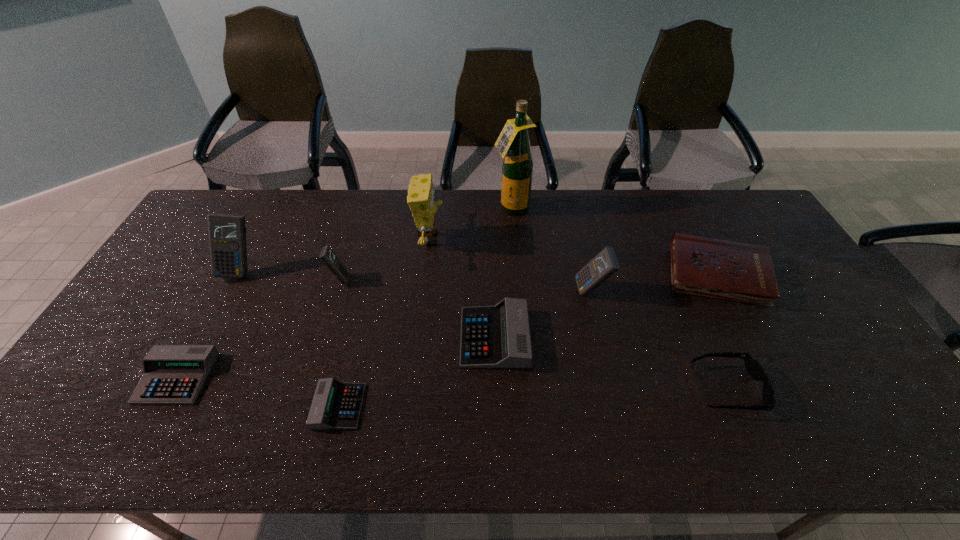
Find the location of a particular element. This screenshot has height=540, width=960. the biggest gray calculator is located at coordinates (498, 336).

Locate an element on the screen. the fourth tallest calculator is located at coordinates pos(498,336).

This screenshot has height=540, width=960. I want to click on sunglasses, so click(753, 367).

Identify the location of the fifth tallest calculator. The width and height of the screenshot is (960, 540). (172, 374).

At what (x,y) coordinates should I click in order to perform the action: click on the second smallest gray calculator. Please return your answer as a coordinate pair (x, y). Looking at the image, I should click on 172,374.

What are the coordinates of `the second gray calculator from left to right` in the screenshot? It's located at (336, 405).

Locate an element on the screen. The image size is (960, 540). the third calculator from right to left is located at coordinates (336, 405).

Where is `free location located on the front-facing side of the tallest object`? The image size is (960, 540). free location located on the front-facing side of the tallest object is located at coordinates pos(514,242).

The width and height of the screenshot is (960, 540). What are the coordinates of `vacant space located 0.070m on the face of the yellow sponge` in the screenshot? It's located at (467, 240).

Locate an element on the screen. vacant space situated 0.220m on the front-facing side of the leftmost blue calculator is located at coordinates (202, 342).